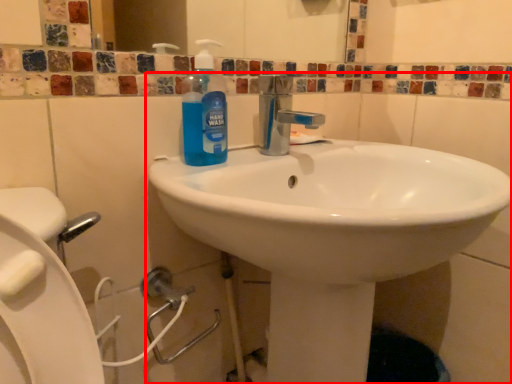
Question: From the image's perspective, considering the relative positions of sink (annotated by the red box) and cleaning product in the image provided, where is sink (annotated by the red box) located with respect to the staircase?

Choices:
 (A) below
 (B) above

Answer: (A)